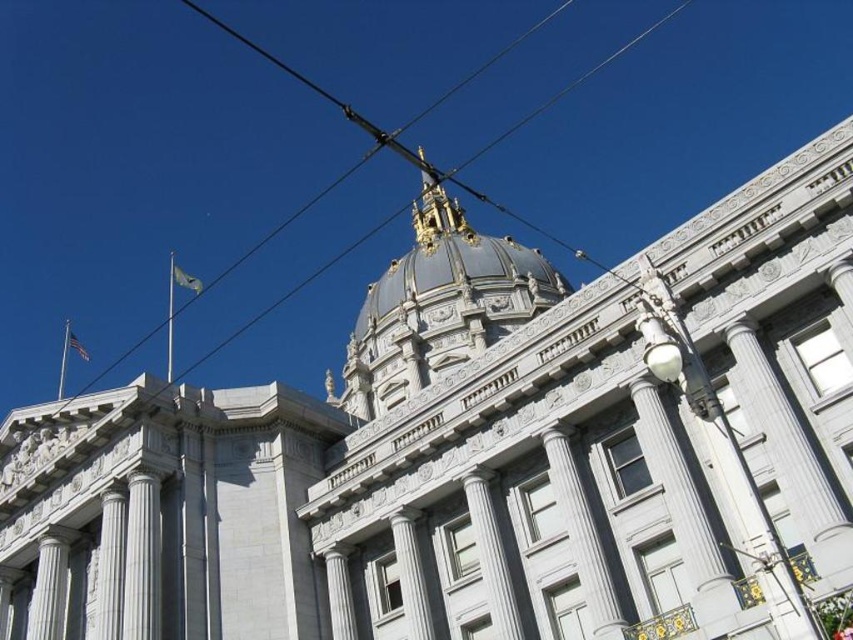
Who is taller, silver metallic flagpole at upper left or blue fabric flag at upper left?

Standing taller between the two is silver metallic flagpole at upper left.

Is point (173, 276) behind point (172, 280)?

No.

You are a GUI agent. You are given a task and a screenshot of the screen. Output one action in this format:
    pyautogui.click(x=<x>, y=<y>)
    Task: Click on the silver metallic flagpole at upper left
    This screenshot has height=640, width=853.
    Given the screenshot: What is the action you would take?
    pyautogui.click(x=170, y=317)

Can you confirm if white marble column at center is positioned above white fabric flag at upper left?

Actually, white marble column at center is below white fabric flag at upper left.

Describe the element at coordinates (142, 560) in the screenshot. I see `white marble column at center` at that location.

I want to click on white marble column at center, so click(x=142, y=560).

Is point (65, 346) positioned in front of point (190, 284)?

No, (65, 346) is further to viewer.

Is white flagpole at upper left further to the viewer compared to blue fabric flag at upper left?

Yes, white flagpole at upper left is behind blue fabric flag at upper left.

Who is more distant from viewer, (67, 344) or (190, 282)?

The point (67, 344) is more distant.

Where is `white flagpole at upper left`? The image size is (853, 640). white flagpole at upper left is located at coordinates (62, 358).